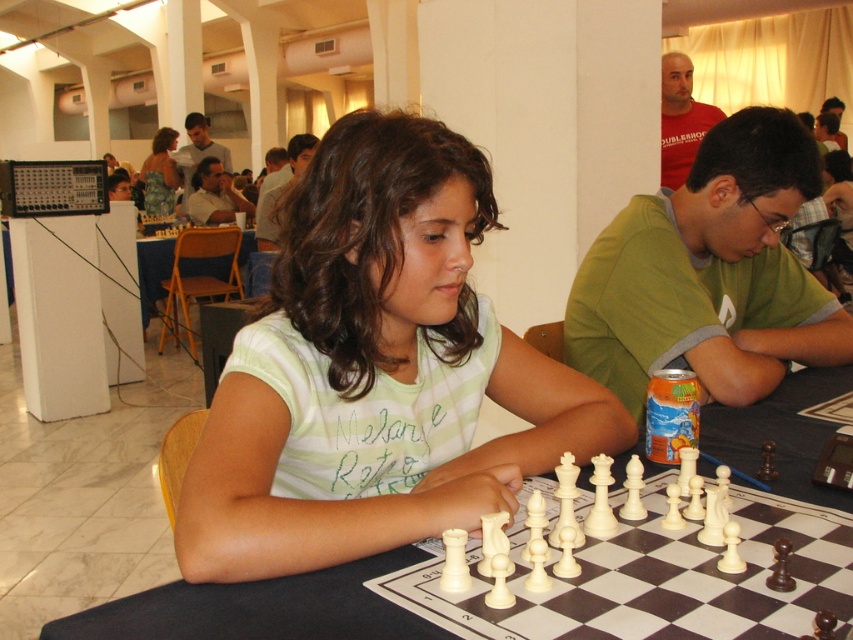
Does matte red shirt at upper right have a larger size compared to matte green shirt at center?

No.

Which of these two, matte red shirt at upper right or matte green shirt at center, stands taller?

matte green shirt at center

Is point (689, 83) closer to camera compared to point (280, 188)?

Yes, point (689, 83) is in front of point (280, 188).

Identify the location of matte red shirt at upper right. (680, 120).

Who is more distant from viewer, (192, 211) or (206, 145)?

The point (206, 145) is behind.

Which is more to the left, matte white shirt at center or smooth brown shirt at center?

Positioned to the left is smooth brown shirt at center.

Is point (219, 218) positioned in front of point (194, 118)?

Yes, point (219, 218) is closer to viewer.

The image size is (853, 640). I want to click on matte white shirt at center, so click(213, 195).

Does point (701, 368) lie behind point (189, 184)?

No, (701, 368) is closer to viewer.

Between green fabric shirt at center and smooth brown shirt at center, which one has less height?

With less height is green fabric shirt at center.

Between point (790, 147) and point (189, 128), which one is positioned behind?

The point (189, 128) is behind.

In order to click on green fabric shirt at center in this screenshot , I will do `click(709, 273)`.